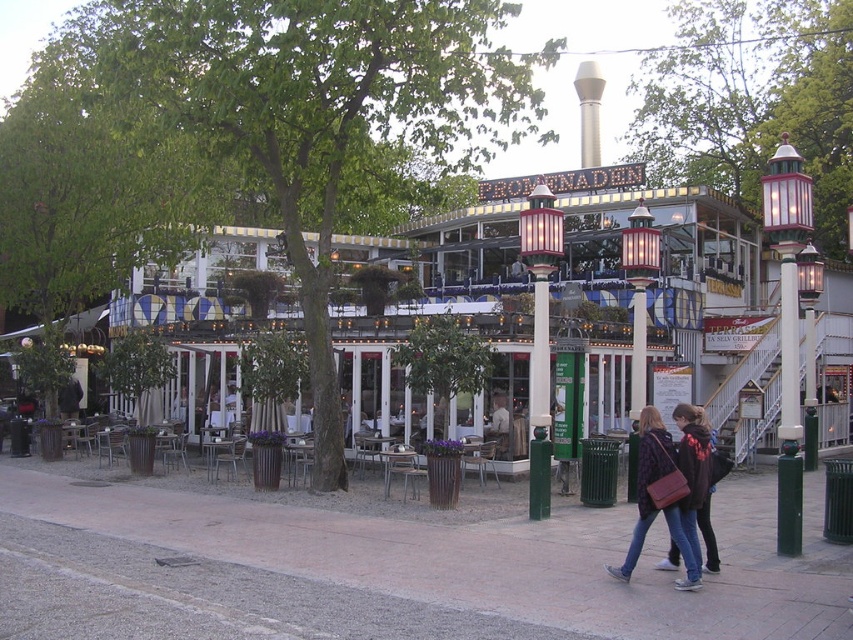
You are a delivery person approaching the Bockshornen restaurant. You need to park your bike near the green painted metal lamp post at right but want to avoid blocking the paved brick sidewalk at center. Based on their positions, where should you place your bike?

Place your bike to the right of the green painted metal lamp post at right since the paved brick sidewalk at center is to the left of the lamp post, so placing it to the right won delivery person avoid blocking the sidewalk.